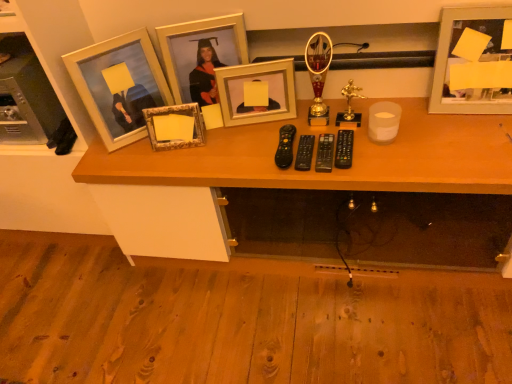
Identify the location of free space between gold textured photo frame at center, which is the fourth picture frame in right-to-left order, and gold metallic picture frame at center, marked as the second picture frame in a right-to-left arrangement. (236, 129).